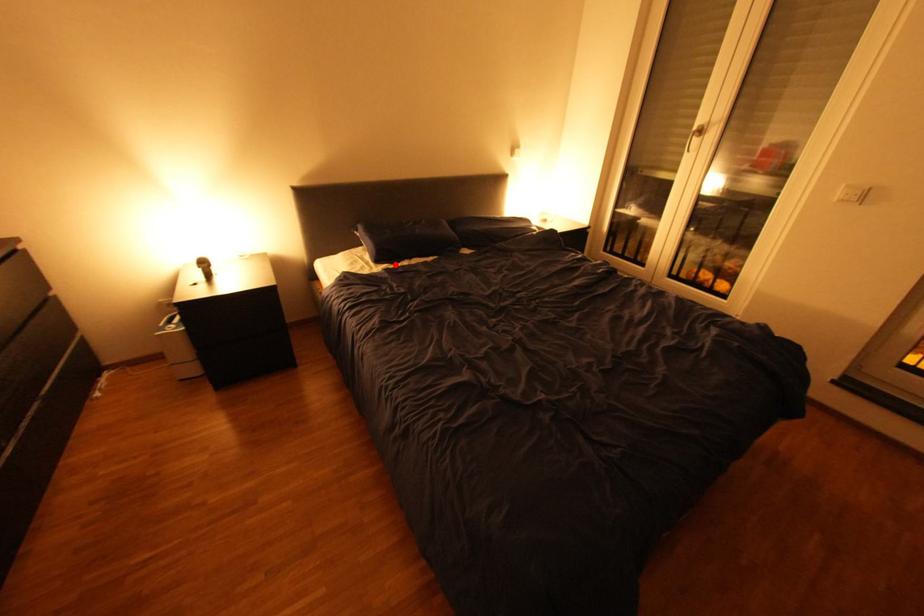
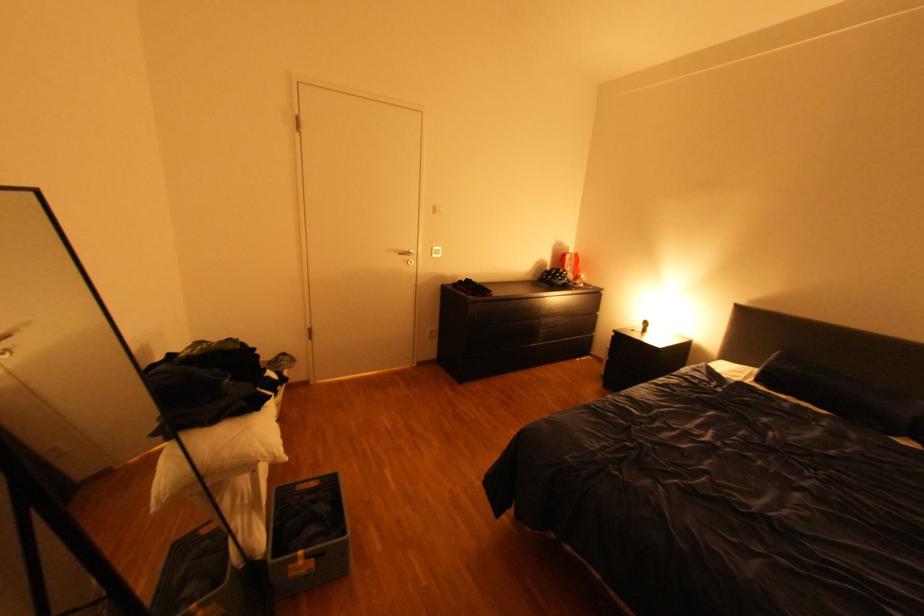
Find the pixel in the second image that matches the highlighted location in the first image.

(771, 387)